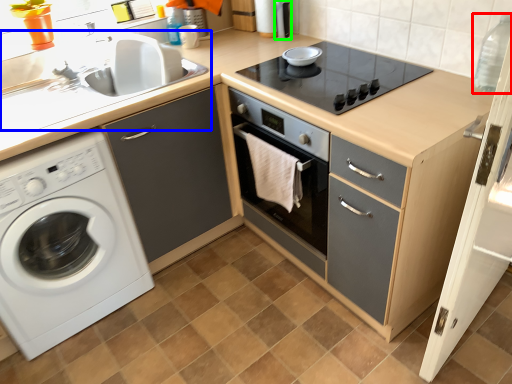
Question: Estimate the real-world distances between objects in this image. Which object is closer to bottle (highlighted by a red box), sink (highlighted by a blue box) or appliance (highlighted by a green box)?

Choices:
 (A) sink
 (B) appliance

Answer: (B)